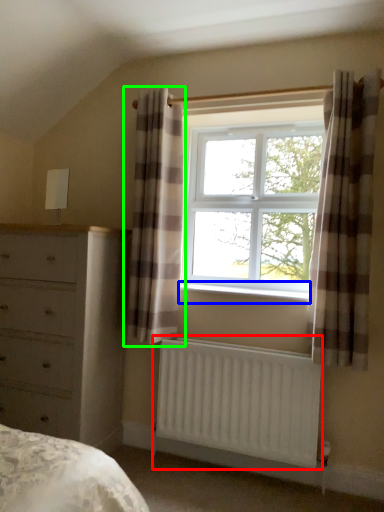
Question: Estimate the real-world distances between objects in this image. Which object is farther from radiator (highlighted by a red box), window sill (highlighted by a blue box) or curtain (highlighted by a green box)?

Choices:
 (A) window sill
 (B) curtain

Answer: (B)